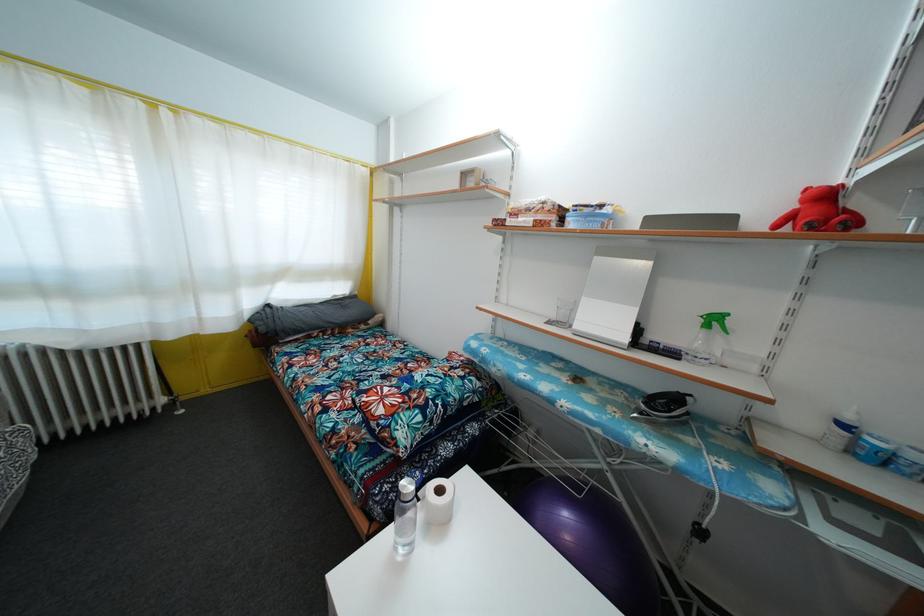
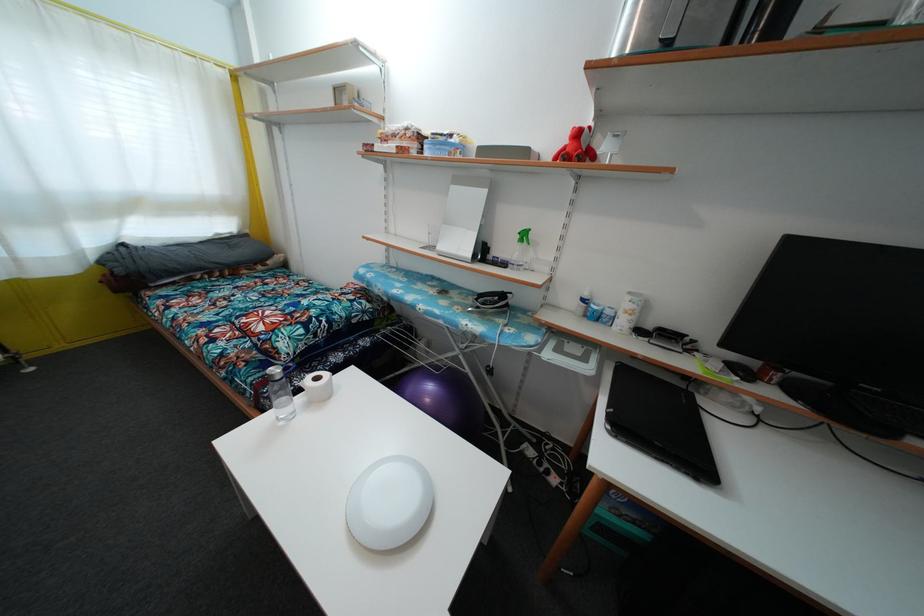
Locate, in the second image, the point that corresponds to the point at 800,213 in the first image.

(570, 148)